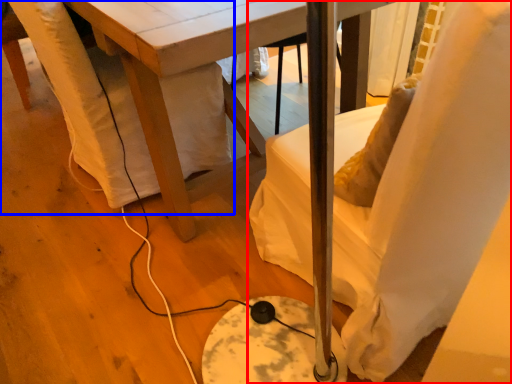
Question: Which object appears farthest to the camera in this image, chair (highlighted by a red box) or swivel chair (highlighted by a blue box)?

Choices:
 (A) chair
 (B) swivel chair

Answer: (B)